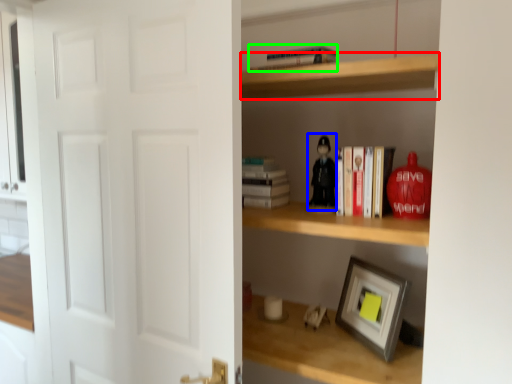
Question: Estimate the real-world distances between objects in this image. Which object is farther from cabinet (highlighted by a red box), toy (highlighted by a blue box) or book (highlighted by a green box)?

Choices:
 (A) toy
 (B) book

Answer: (A)